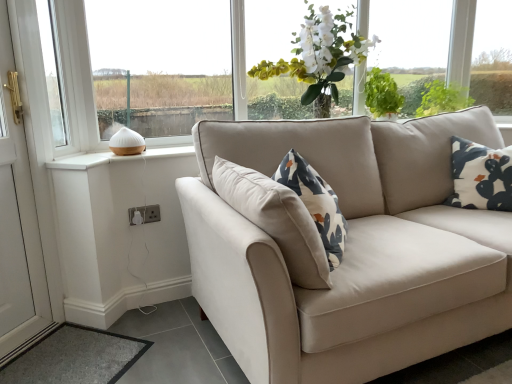
Question: Does gray carpet at lower left have a greater height compared to white plastic window at upper left, which is the first window in left-to-right order?

Choices:
 (A) yes
 (B) no

Answer: (B)

Question: Is gray carpet at lower left far away from white plastic window at upper left, which is the first window in left-to-right order?

Choices:
 (A) yes
 (B) no

Answer: (A)

Question: Considering the relative positions of gray carpet at lower left and white plastic window at upper left, which is the first window in left-to-right order, in the image provided, is gray carpet at lower left to the left of white plastic window at upper left, which is the first window in left-to-right order, from the viewer's perspective?

Choices:
 (A) no
 (B) yes

Answer: (A)

Question: From the image's perspective, is gray carpet at lower left above white plastic window at upper left, arranged as the second window when viewed from the right?

Choices:
 (A) yes
 (B) no

Answer: (B)

Question: Is gray carpet at lower left smaller than white plastic window at upper left, arranged as the second window when viewed from the right?

Choices:
 (A) yes
 (B) no

Answer: (A)

Question: Do you think white glossy door at left is within white silk flowers at upper center, or outside of it?

Choices:
 (A) inside
 (B) outside

Answer: (B)

Question: From their relative heights in the image, would you say white glossy door at left is taller or shorter than white silk flowers at upper center?

Choices:
 (A) tall
 (B) short

Answer: (A)

Question: From a real-world perspective, relative to white silk flowers at upper center, is white glossy door at left vertically above or below?

Choices:
 (A) above
 (B) below

Answer: (B)

Question: Visually, is white glossy door at left positioned to the left or to the right of white silk flowers at upper center?

Choices:
 (A) right
 (B) left

Answer: (B)

Question: From a real-world perspective, is gray carpet at lower left above or below white plastic socket at lower left?

Choices:
 (A) below
 (B) above

Answer: (A)

Question: Looking at their shapes, would you say gray carpet at lower left is wider or thinner than white plastic socket at lower left?

Choices:
 (A) thin
 (B) wide

Answer: (B)

Question: Is point (52, 337) closer or farther from the camera than point (157, 210)?

Choices:
 (A) closer
 (B) farther

Answer: (A)

Question: Relative to white plastic socket at lower left, is gray carpet at lower left in front or behind?

Choices:
 (A) behind
 (B) front

Answer: (B)

Question: From their relative heights in the image, would you say gray carpet at lower left is taller or shorter than white ceramic diffuser at left, acting as the 1th window starting from the right?

Choices:
 (A) short
 (B) tall

Answer: (A)

Question: Considering their positions, is gray carpet at lower left located in front of or behind white ceramic diffuser at left, the second window positioned from the left?

Choices:
 (A) front
 (B) behind

Answer: (A)